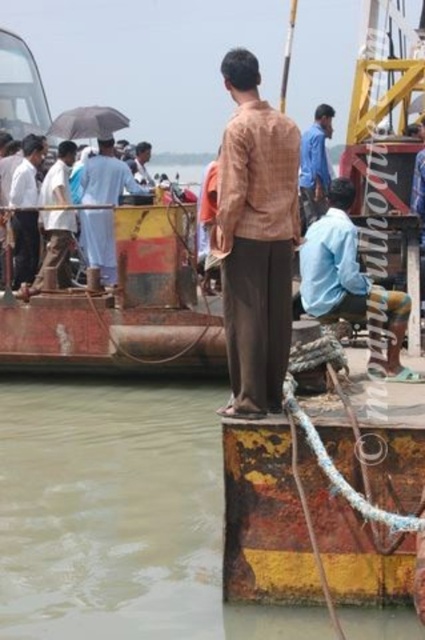
Between blue cotton shirt at upper center and light brown fabric shirt at center, which one is positioned higher?

light brown fabric shirt at center is above.

Between point (306, 141) and point (144, 172), which one is positioned in front?

Point (306, 141) is in front.

Find the location of a particular element. The image size is (425, 640). blue cotton shirt at upper center is located at coordinates (314, 166).

Is brown checkered shirt at center bigger than blue cotton shirt at upper center?

Incorrect, brown checkered shirt at center is not larger than blue cotton shirt at upper center.

How distant is brown checkered shirt at center from blue cotton shirt at upper center?

brown checkered shirt at center and blue cotton shirt at upper center are 7.93 meters apart.

Locate an element on the screen. This screenshot has height=640, width=425. brown checkered shirt at center is located at coordinates (255, 237).

Is point (110, 442) closer to camera compared to point (323, 204)?

That is True.

Looking at this image, between brown murky water at lower left and blue cotton shirt at upper center, which one appears on the right side from the viewer's perspective?

From the viewer's perspective, blue cotton shirt at upper center appears more on the right side.

Is point (119, 632) behind point (314, 176)?

No, (119, 632) is in front of (314, 176).

I want to click on brown murky water at lower left, so click(110, 512).